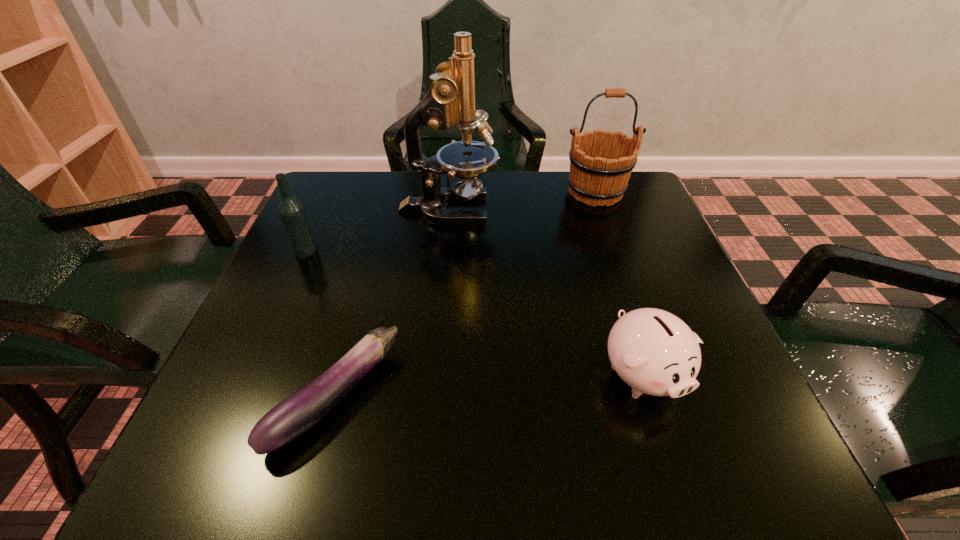
The width and height of the screenshot is (960, 540). Identify the location of the fourth closest object to the eggplant. (598, 176).

In order to click on blank space that satisfies the following two spatial constraints: 1. at the eyepiece of the microscope; 2. on the front side of the vodka in this screenshot , I will do (444, 251).

The width and height of the screenshot is (960, 540). What are the coordinates of `free location that satisfies the following two spatial constraints: 1. on the back side of the piggy bank; 2. on the left side of the fourth shortest object` in the screenshot? It's located at (585, 193).

In order to click on vacant space that satisfies the following two spatial constraints: 1. at the eyepiece of the tallest object; 2. on the back side of the piggy bank in this screenshot , I will do `click(434, 374)`.